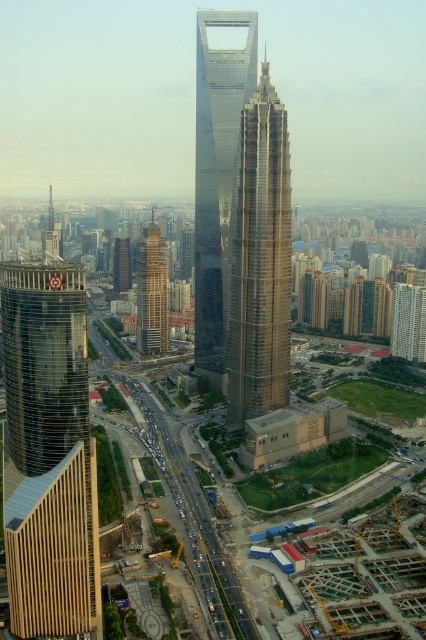
You are an architect evaluating the urban skyline. Based on the image, which of the two buildings, the gold reflective skyscraper at center or the dark brown glass building at center, has a greater height?

The gold reflective skyscraper at center is much taller than the dark brown glass building at center, so it has a greater height.

You are a city planner analyzing the urban layout. Given the brown textured building at center and the dark brown glass building at center, which one is positioned higher in the image?

The brown textured building at center is positioned higher in the image than the dark brown glass building at center, as it is above it.